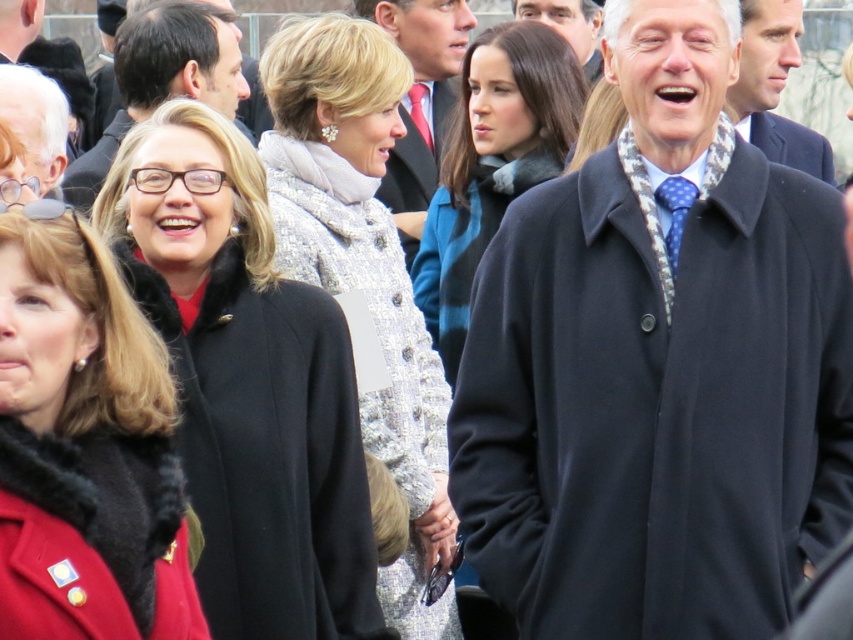
You are a photographer standing at the center of the scene. You want to take a photo of the matte black coat at upper left and the polka dot silk tie at center. Given that your camera has a maximum focus range of 8 meters, will both subjects be in focus?

The matte black coat at upper left is 8.67 meters away from the polka dot silk tie at center. Since the camera can only focus up to 8 meters, the distance between them exceeds the focus range, so both subjects cannot be in focus simultaneously.

You are a photographer at this event and need to ensure that both the matte black coat at upper left and the polka dot silk tie at center are visible in your photo. Given their sizes, which one might require you to adjust your camera angle to avoid being too small in the frame?

The polka dot silk tie at center is smaller than the matte black coat at upper left, so it might require adjusting the camera angle to ensure it is not too small in the frame.

You are standing at the point marked by the coordinates point (567, 26). Looking around, you see a smooth blue tie at center. Which direction should you move to reach the smooth blue tie at center?

Since you are already at the point marked by the coordinates point (567, 26), which is on the smooth blue tie at center, you don not need to move further to reach it.